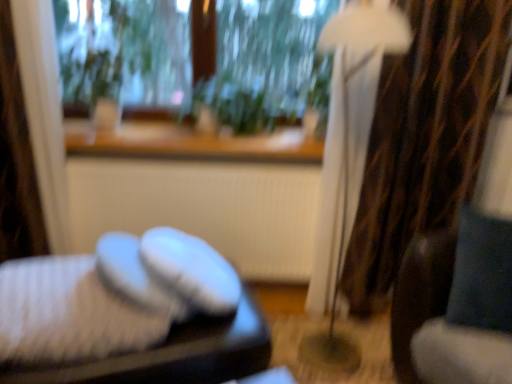
At what (x,y) coordinates should I click in order to perform the action: click on free space above white matte radiator at center (from a real-world perspective). Please return your answer as a coordinate pair (x, y). Looking at the image, I should click on (230, 157).